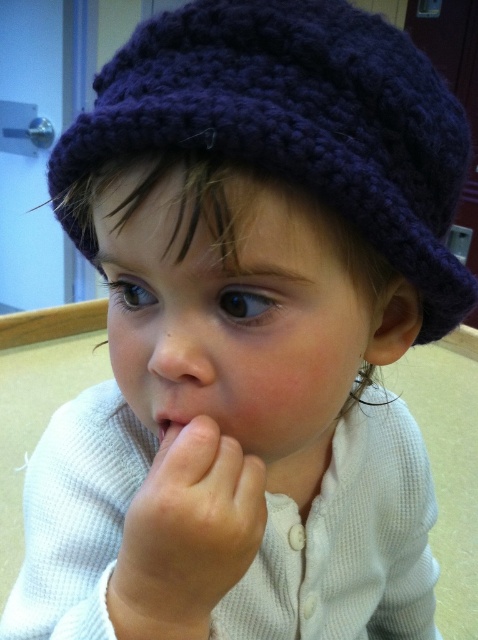
Question: Which of the following is the farthest from the observer?

Choices:
 (A) (258, 12)
 (B) (213, 554)

Answer: (A)

Question: Is smooth skin hand at center bigger than smooth skin nose at center?

Choices:
 (A) no
 (B) yes

Answer: (B)

Question: Does dark blue knitted hat at upper center come behind smooth skin hand at center?

Choices:
 (A) no
 (B) yes

Answer: (A)

Question: Does dark blue knitted hat at upper center appear over smooth skin nose at center?

Choices:
 (A) no
 (B) yes

Answer: (B)

Question: Considering the real-world distances, which object is closest to the smooth flesh at center?

Choices:
 (A) smooth skin hand at center
 (B) smooth skin nose at center

Answer: (B)

Question: Which point is closer to the camera taking this photo?

Choices:
 (A) (153, 356)
 (B) (164, 422)
 (C) (206, 157)
 (D) (213, 484)

Answer: (C)